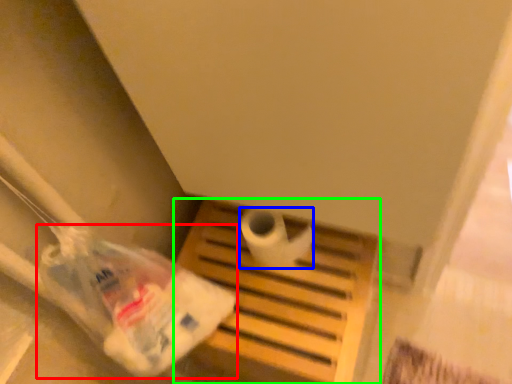
Question: Which object is positioned farthest from plastic bag (highlighted by a red box)? Select from toilet paper (highlighted by a blue box) and furniture (highlighted by a green box).

Choices:
 (A) toilet paper
 (B) furniture

Answer: (A)